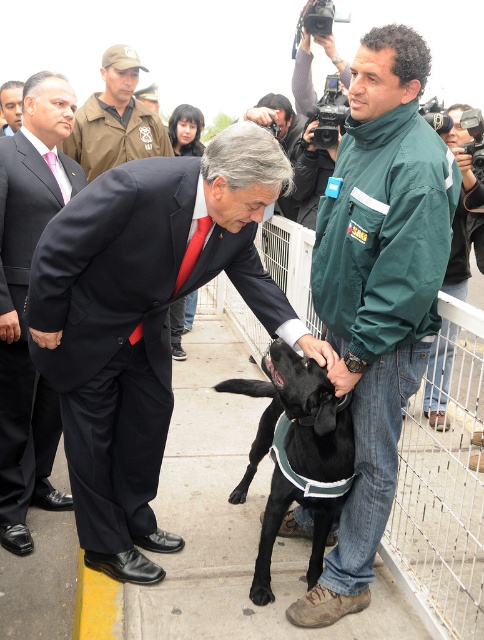
You are a photographer trying to capture a photo of the two people in the foreground. Which person should you focus on first if you want to include both the camouflage uniform at upper left and the green fabric jacket at upper right in your frame?

You should focus on the camouflage uniform at upper left first because it is positioned on the left side of the green fabric jacket at upper right, allowing you to frame both individuals from left to right.

You are a photographer at the event and want to capture a photo of the black matte dog at center without any distractions. Since the camouflage uniform at upper left is in the way, can you move to the right side to get a clear shot?

The black matte dog at center is positioned under camouflage uniform at upper left, so moving to the right side might still have the camouflage uniform at upper left in the frame. Consider moving to the left side instead to avoid the camouflage uniform at upper left.

Consider the image. You are a photographer at a public event. You need to capture a clear photo of the matte black suit at center and the matte black suit at left. Can you focus on both subjects simultaneously?

The matte black suit at center is in front of the matte black suit at left, so focusing on both might be challenging due to their overlapping positions.